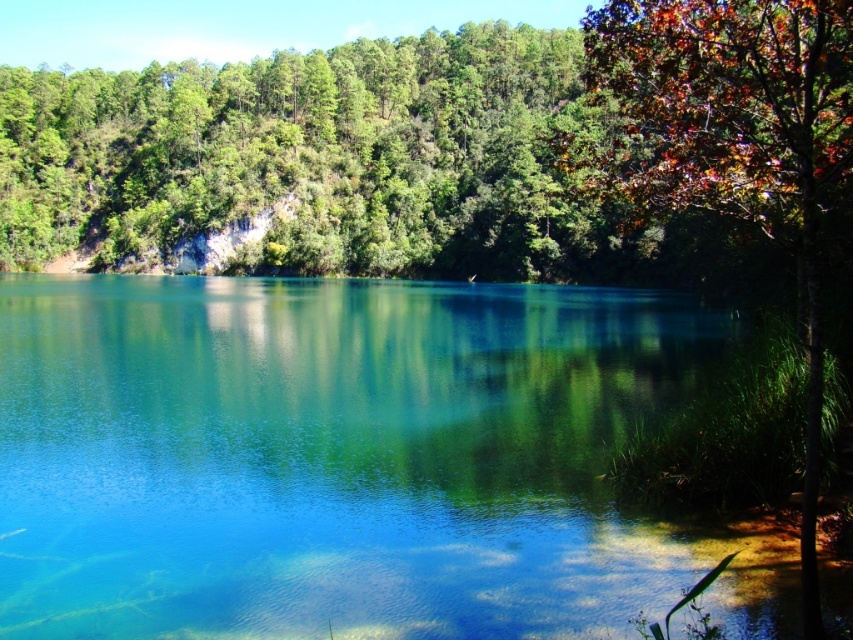
You are standing on the shore of the lake and see the transparent water at center and the autumn leaves at right. Which object is closer to your left side?

The transparent water at center is closer to your left side because it is positioned to the left of autumn leaves at right.

You are standing on the shore looking at the transparent water at center and autumn leaves at right. Which object is closer to the water surface?

The transparent water at center is below autumn leaves at right, so the autumn leaves at right are closer to the water surface.